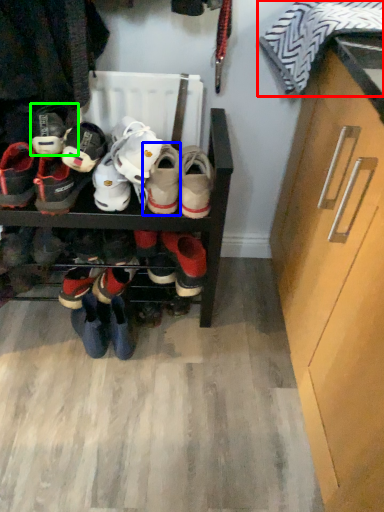
Question: Considering the real-world distances, which object is farthest from clothing (highlighted by a red box)? footwear (highlighted by a blue box) or footwear (highlighted by a green box)?

Choices:
 (A) footwear
 (B) footwear

Answer: (B)